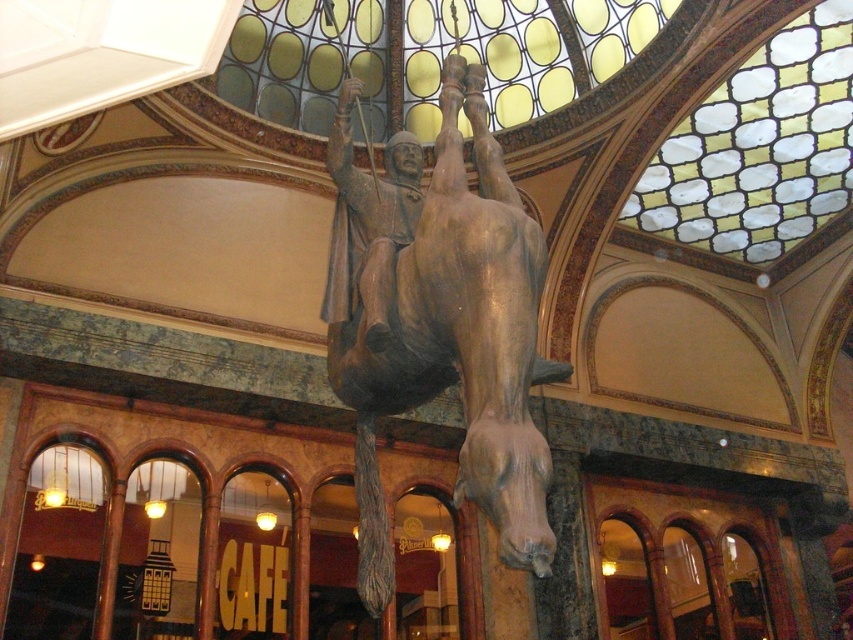
Which is below, bronze statue at center or wooden statue at center?

bronze statue at center is below.

Which is behind, point (395, 257) or point (347, 148)?

Point (347, 148)

Where is `bronze statue at center`? bronze statue at center is located at coordinates (440, 323).

Which of these two, bronze statue at center or stained glass mosaic at upper center, stands taller?

With more height is bronze statue at center.

Can you confirm if bronze statue at center is positioned above stained glass mosaic at upper center?

Actually, bronze statue at center is below stained glass mosaic at upper center.

This screenshot has height=640, width=853. What do you see at coordinates (440, 323) in the screenshot?
I see `bronze statue at center` at bounding box center [440, 323].

This screenshot has height=640, width=853. Find the location of `bronze statue at center`. bronze statue at center is located at coordinates (440, 323).

Does stained glass mosaic at upper center appear on the left side of wooden statue at center?

No, stained glass mosaic at upper center is not to the left of wooden statue at center.

Is point (845, 26) positioned in front of point (393, 289)?

No, (845, 26) is behind (393, 289).

Identify the location of stained glass mosaic at upper center. This screenshot has height=640, width=853. (759, 148).